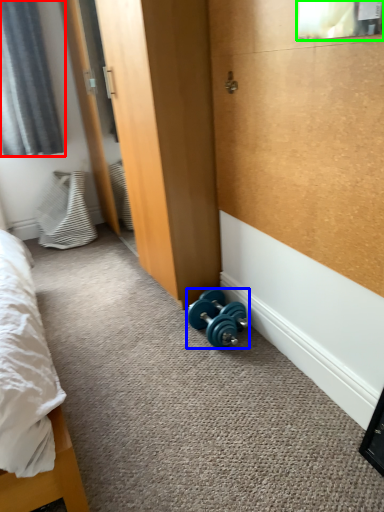
Question: Which object is the farthest from curtain (highlighted by a red box)? Choose among these: dumbbell (highlighted by a blue box) or window screen (highlighted by a green box).

Choices:
 (A) dumbbell
 (B) window screen

Answer: (B)